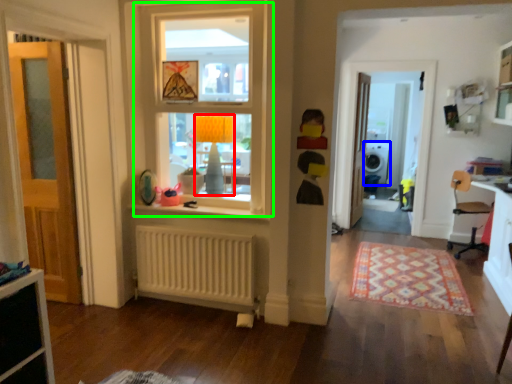
Question: Which object is the closest to the lamp (highlighted by a red box)? Choose among these: dish washer (highlighted by a blue box) or window (highlighted by a green box).

Choices:
 (A) dish washer
 (B) window

Answer: (B)